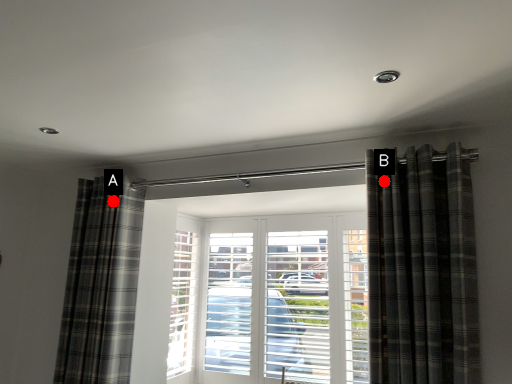
Question: Two points are circled on the image, labeled by A and B beside each circle. Among these points, which one is nearest to the camera?

Choices:
 (A) A is closer
 (B) B is closer

Answer: (B)